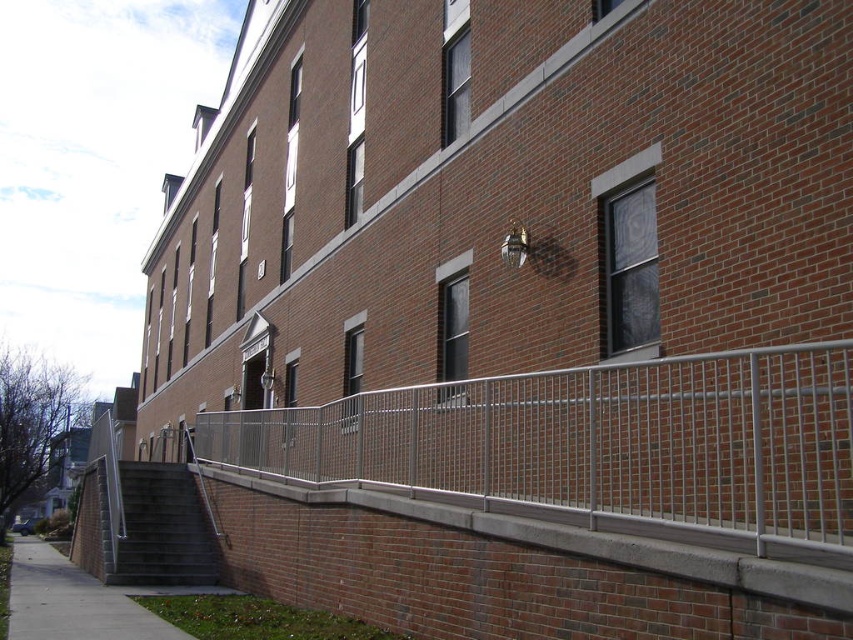
You are standing at the entrance of the multi story brick building and want to locate two specific points marked on the building facade. The first point is at coordinate point (186, 556) and the second is at point (30, 579). From your current position, which point is closer to the building entrance?

Point (30, 579) is closer to the building entrance because it is in front of point (186, 556), which is further back on the facade.

You are a delivery person with a cart that is 16 feet wide. You need to move your cart from the gray concrete sidewalk at lower left to the silver metallic railing at lower center. Can you fit your cart through the space between them?

The distance between the gray concrete sidewalk at lower left and the silver metallic railing at lower center is 16.46 feet. Since your cart is 16 feet wide, it can fit through the space between them as there is enough clearance.

You are a delivery person trying to decide whether to park your vehicle near the silver metallic railing at lower center or the gray concrete sidewalk at lower left. Since you need to ensure your vehicle won

The silver metallic railing at lower center is not as tall as the gray concrete sidewalk at lower left, so parking near the gray concrete sidewalk at lower left would provide better protection from potential weather elements due to its height.